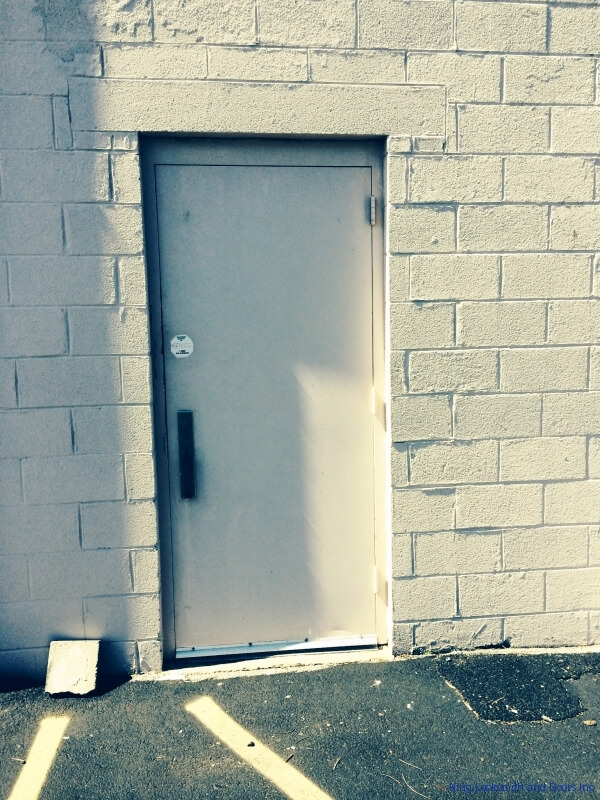
Find the location of a particular element. wall is located at coordinates (524, 554).